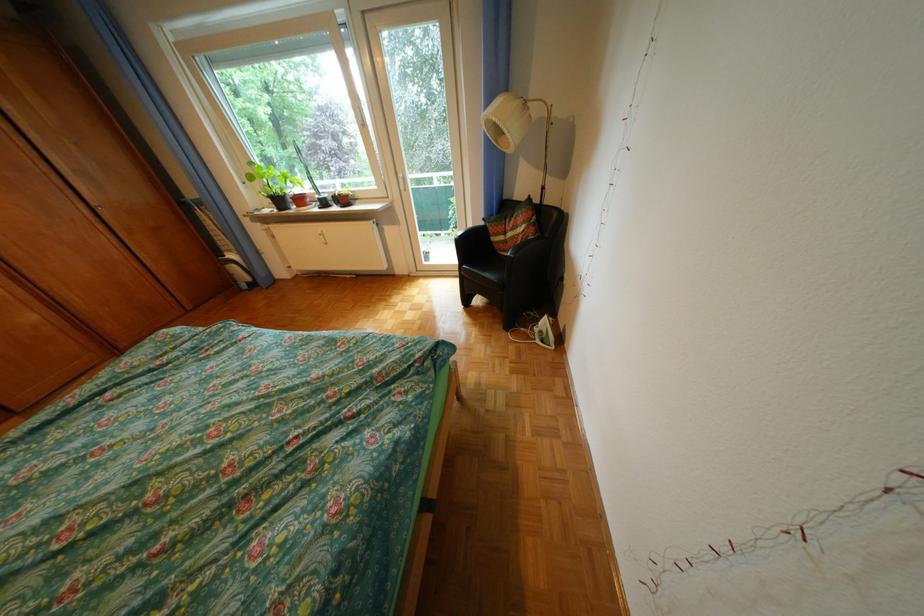
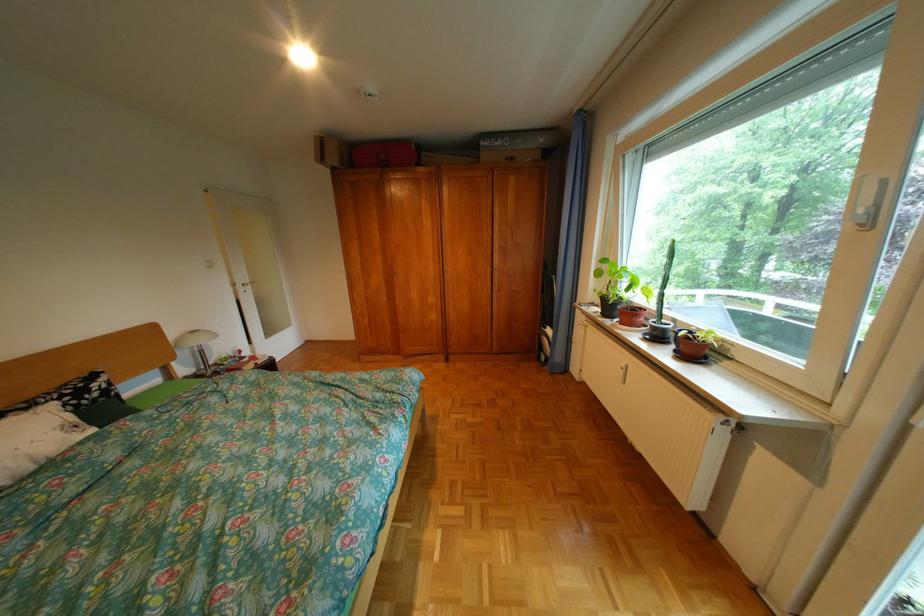
The point at [313,207] is marked in the first image. Where is the corresponding point in the second image?

(636, 323)